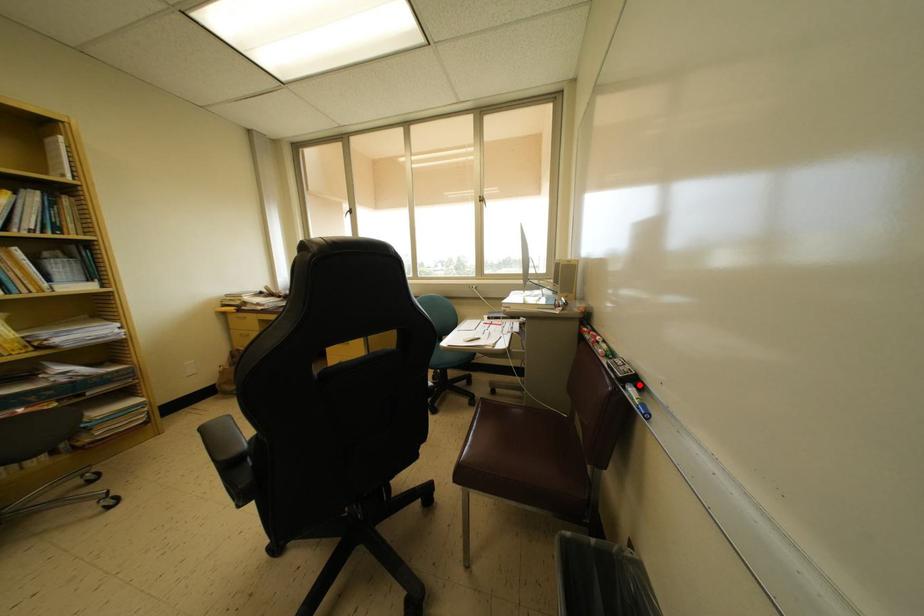
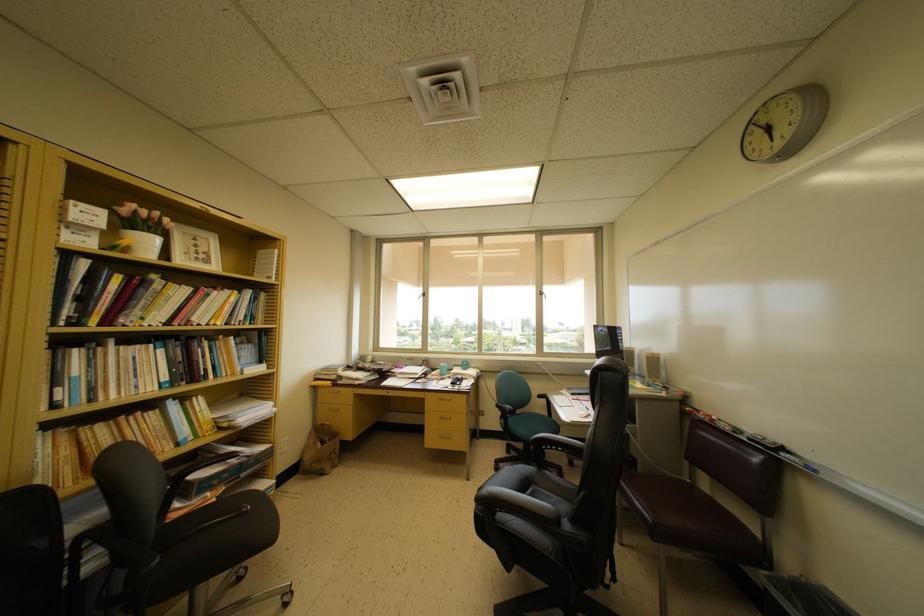
The point at the highlighted location is marked in the first image. Where is the corresponding point in the second image?

(786, 454)